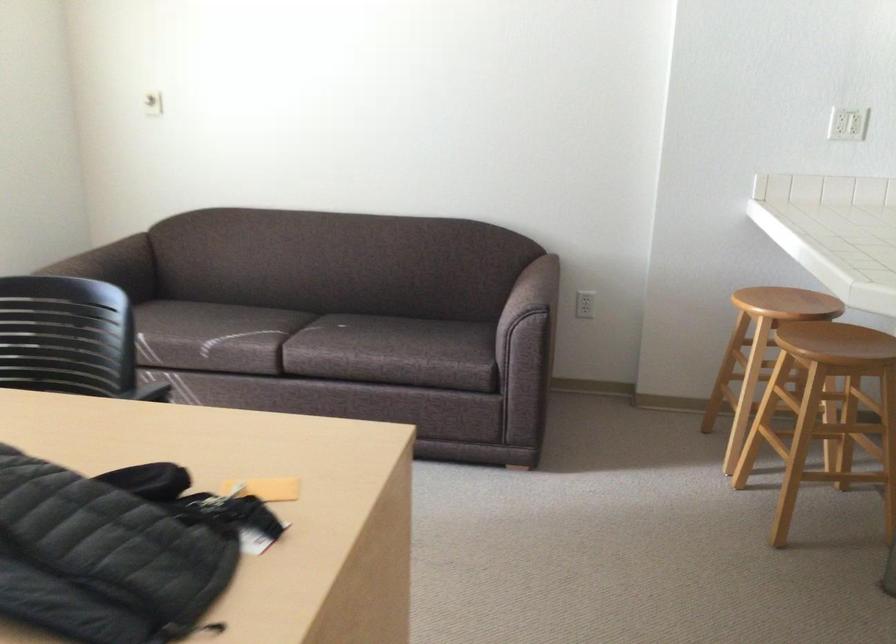
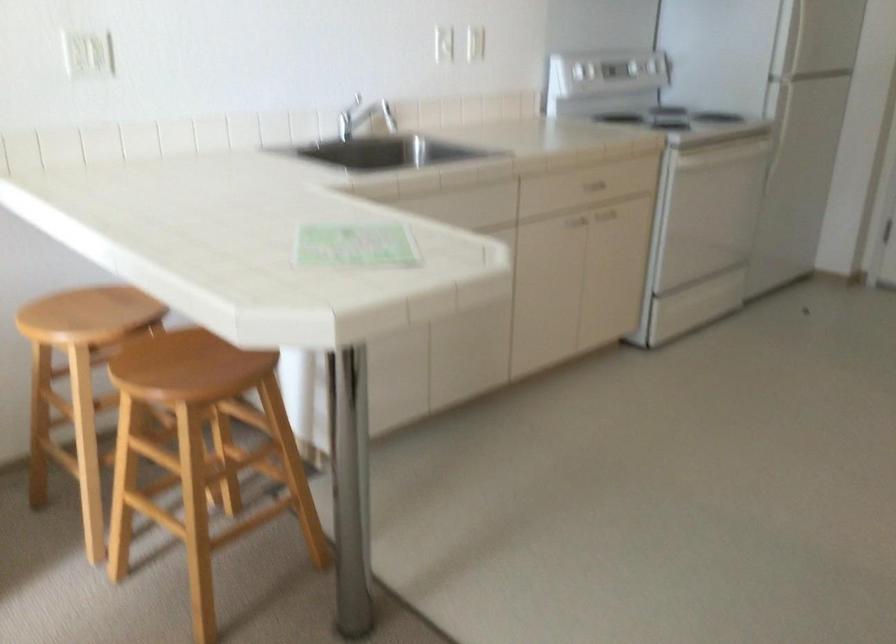
In the second image, find the point that corresponds to pixel 782 297 in the first image.

(82, 315)